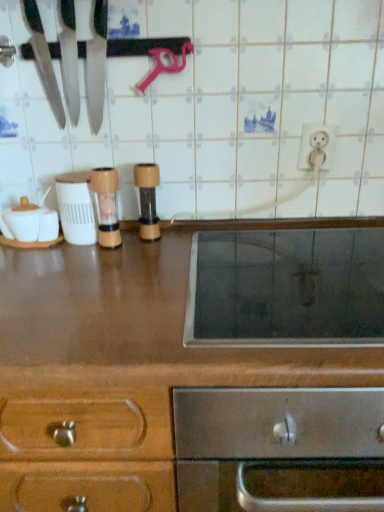
Find the location of a particular element. Image resolution: width=384 pixels, height=512 pixels. free location to the right of wooden pepper grinder at center, placed as the second appliance when sorted from right to left is located at coordinates (169, 247).